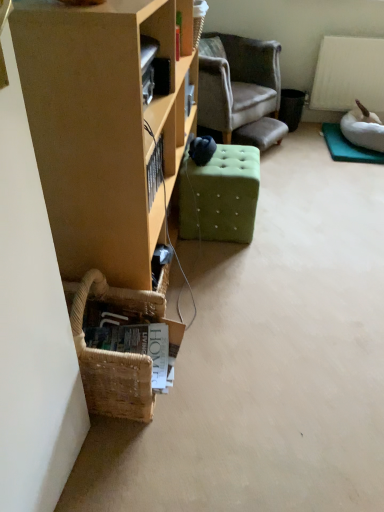
Where is `vacant space in front of green tufted ottoman at center`? This screenshot has height=512, width=384. vacant space in front of green tufted ottoman at center is located at coordinates (233, 260).